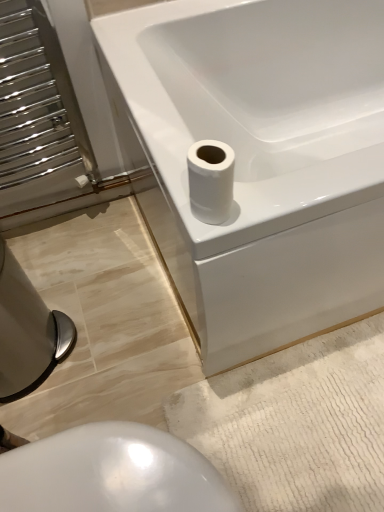
The height and width of the screenshot is (512, 384). In order to click on unoccupied region to the right of brushed metal bidet at lower left, which ranks as the first bidet in left-to-right order in this screenshot , I will do `click(117, 339)`.